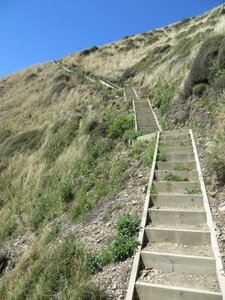
Find the location of `2nd stair`. 2nd stair is located at coordinates (191, 253).